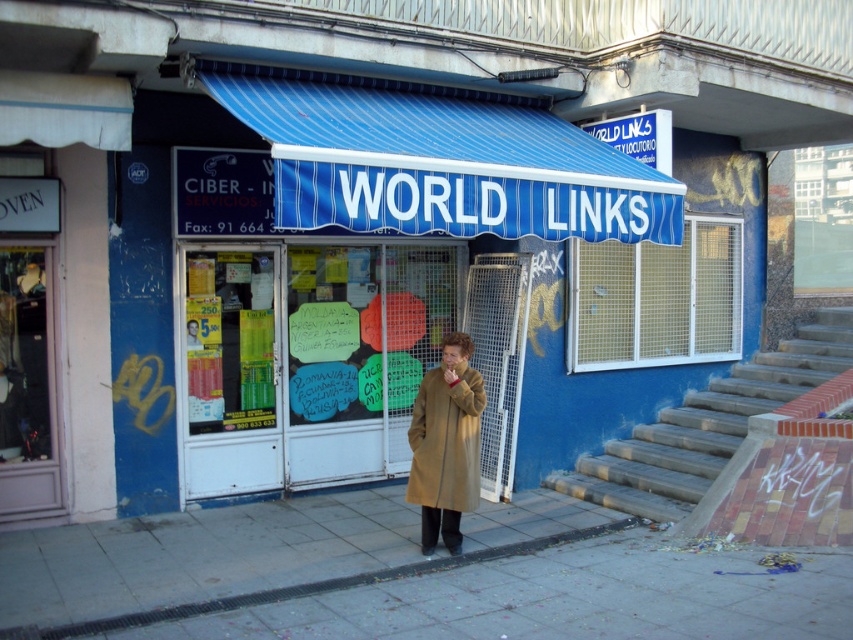
You are standing in front of the World Links storefront and notice two points marked on the entrance. The first point is at coordinate (x=485, y=573) and the second at (x=459, y=506). Which point is closer to you?

Point (x=485, y=573) is closer to the viewer than point (x=459, y=506).

You are standing on the sidewalk in front of the World Links store. You need to place a small potted plant exactly at the center of the smooth concrete pavement at center. Where should you place it?

You should place the small potted plant at the coordinates point (404, 577) where the smooth concrete pavement at center is located.